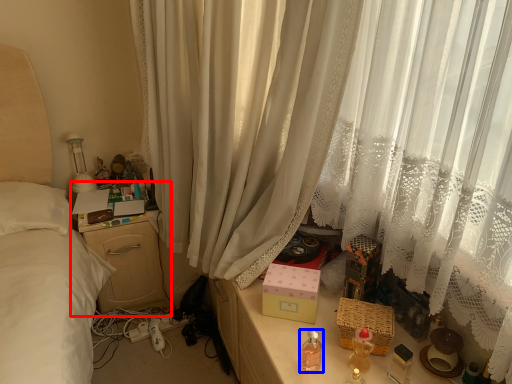
Question: Among these objects, which one is nearest to the camera, nightstand (highlighted by a red box) or baby bottle (highlighted by a blue box)?

Choices:
 (A) nightstand
 (B) baby bottle

Answer: (B)